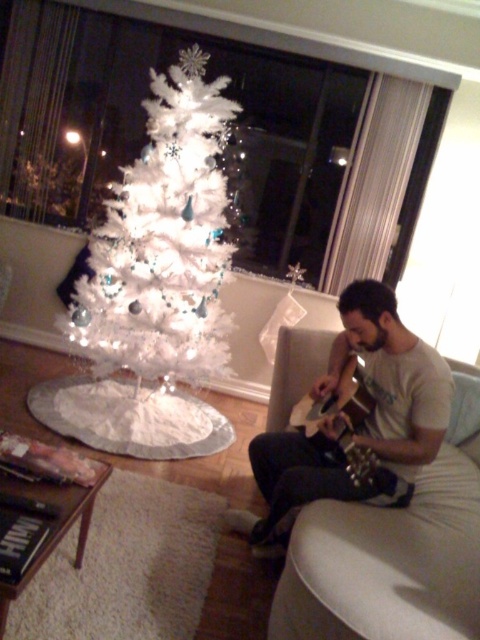
Question: Does white feathered tree at center appear on the left side of matte brown acoustic guitar at center-right?

Choices:
 (A) yes
 (B) no

Answer: (A)

Question: Which point is farther from the camera taking this photo?

Choices:
 (A) (308, 440)
 (B) (63, 284)
 (C) (337, 406)

Answer: (B)

Question: Does beige cotton shirt at center lie behind matte brown acoustic guitar at center-right?

Choices:
 (A) no
 (B) yes

Answer: (A)

Question: Which point is farther to the camera?

Choices:
 (A) white feathered tree at center
 (B) beige cotton shirt at center

Answer: (A)

Question: Is white feathered tree at center positioned behind matte brown acoustic guitar at center-right?

Choices:
 (A) yes
 (B) no

Answer: (A)

Question: Which point is farther to the camera?

Choices:
 (A) (317, 435)
 (B) (402, 339)
 (C) (181, 264)

Answer: (C)